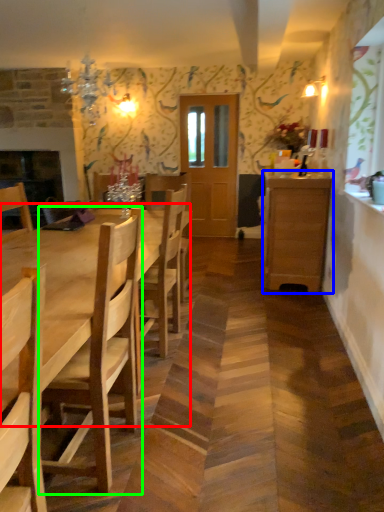
Question: Estimate the real-world distances between objects in this image. Which object is closer to kitchen & dining room table (highlighted by a red box), cabinetry (highlighted by a blue box) or chair (highlighted by a green box)?

Choices:
 (A) cabinetry
 (B) chair

Answer: (B)